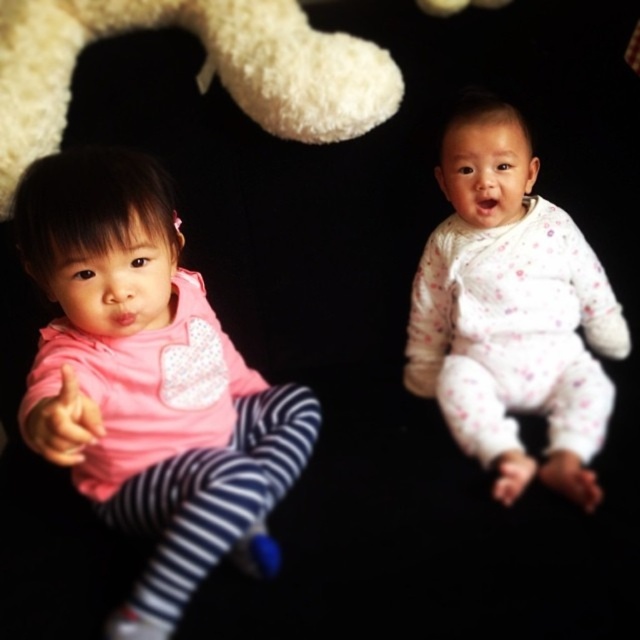
You are a photographer standing 30 inches away from the camera. You want to take a photo of the pink fabric shirt at left. Is the shirt within your reach to adjust its position?

The pink fabric shirt at left is 24.04 inches away from the viewer, so yes, it is within reach since the photographer is standing 30 inches away from the camera.